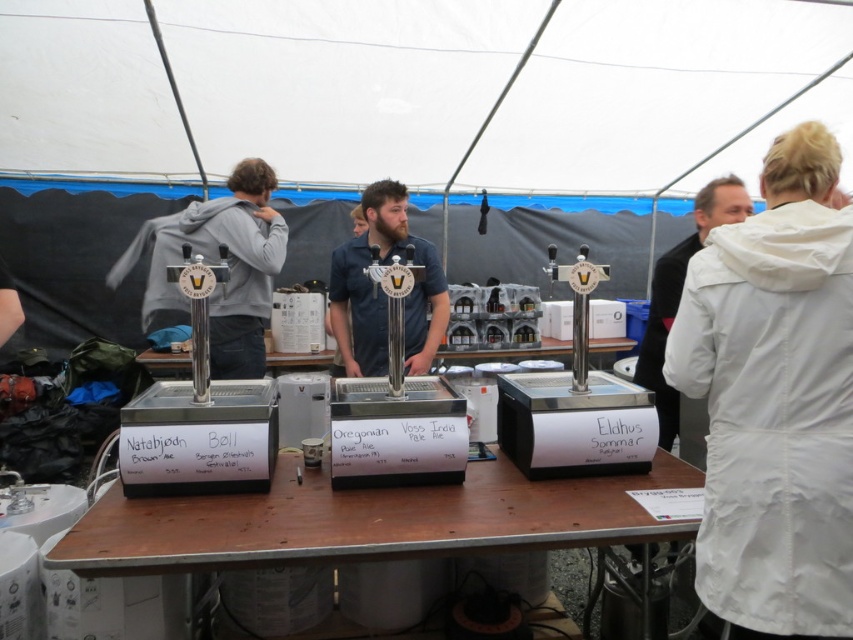
Can you confirm if white matte lab coat at right is shorter than white matte jacket at right?

Yes.

Can you confirm if white matte lab coat at right is wider than white matte jacket at right?

Incorrect, white matte lab coat at right's width does not surpass white matte jacket at right's.

The image size is (853, 640). Describe the element at coordinates (773, 417) in the screenshot. I see `white matte lab coat at right` at that location.

Identify the location of white matte lab coat at right. (773, 417).

Which is behind, point (445, 545) or point (418, 372)?

Positioned behind is point (418, 372).

Does wooden table at center have a larger size compared to blue denim shirt at center?

No, wooden table at center is not bigger than blue denim shirt at center.

The width and height of the screenshot is (853, 640). Find the location of `wooden table at center`. wooden table at center is located at coordinates 367,520.

Consider the image. Who is more distant from viewer, [276,524] or [653,298]?

Positioned behind is point [653,298].

Which is above, wooden table at center or white matte jacket at right?

Positioned higher is white matte jacket at right.

Is point (560, 484) less distant than point (654, 400)?

Yes, it is in front of point (654, 400).

Where is `wooden table at center`? This screenshot has height=640, width=853. wooden table at center is located at coordinates (367, 520).